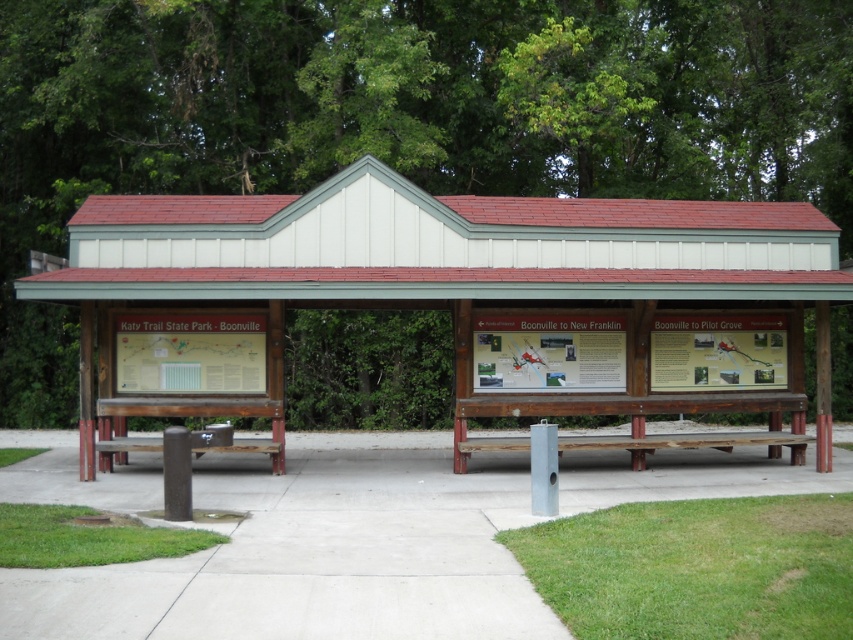
Can you confirm if wooden bench at center is wider than brown wooden bench at center?

Indeed, wooden bench at center has a greater width compared to brown wooden bench at center.

You are a GUI agent. You are given a task and a screenshot of the screen. Output one action in this format:
    pyautogui.click(x=<x>, y=<y>)
    Task: Click on the wooden bench at center
    The height and width of the screenshot is (640, 853).
    Given the screenshot: What is the action you would take?
    pyautogui.click(x=463, y=300)

Can you confirm if concrete at center is thinner than brown wooden bench at center?

In fact, concrete at center might be wider than brown wooden bench at center.

Consider the image. Does concrete at center have a greater width compared to brown wooden bench at center?

Yes, concrete at center is wider than brown wooden bench at center.

Between point (564, 500) and point (634, 442), which one is positioned in front?

Point (564, 500)

Find the location of a particular element. Image resolution: width=853 pixels, height=640 pixels. concrete at center is located at coordinates (317, 554).

The height and width of the screenshot is (640, 853). Describe the element at coordinates (689, 442) in the screenshot. I see `brown wooden bench at center` at that location.

Does brown wooden bench at center have a smaller size compared to brown wooden bench at lower left?

Yes.

Describe the element at coordinates (689, 442) in the screenshot. I see `brown wooden bench at center` at that location.

Where is `brown wooden bench at center`? This screenshot has height=640, width=853. brown wooden bench at center is located at coordinates (689, 442).